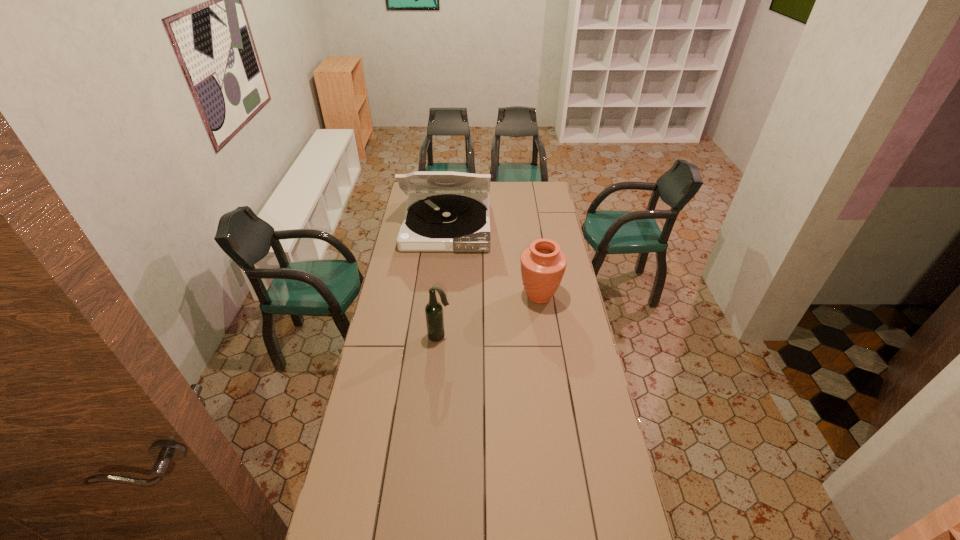
At what (x,y) coordinates should I click in order to perform the action: click on vacant space at the left edge of the desktop. Please return your answer as a coordinate pair (x, y). Looking at the image, I should click on (352, 430).

Where is `vacant space at the right edge`? vacant space at the right edge is located at coordinates (566, 425).

Where is `vacant point located between the nearest object and the vase`? vacant point located between the nearest object and the vase is located at coordinates (490, 316).

Image resolution: width=960 pixels, height=540 pixels. Identify the location of vacant area between the vase and the beer bottle. (490, 316).

Where is `unoccupied area between the rightmost object and the nearest object`? This screenshot has height=540, width=960. unoccupied area between the rightmost object and the nearest object is located at coordinates (490, 316).

The height and width of the screenshot is (540, 960). Find the location of `empty space between the farthest object and the rightmost object`. empty space between the farthest object and the rightmost object is located at coordinates (493, 261).

What are the coordinates of `vacant area that lies between the vase and the tallest object` in the screenshot? It's located at (493, 261).

At what (x,y) coordinates should I click in order to perform the action: click on object that is the closest to the farthest object. Please return your answer as a coordinate pair (x, y). This screenshot has height=540, width=960. Looking at the image, I should click on (543, 265).

Identify the location of object that ranks as the closest to the vase. (446, 211).

Where is `free point that satisfies the following two spatial constraints: 1. on the control panel of the nearest object; 2. on the left side of the tallest object`? free point that satisfies the following two spatial constraints: 1. on the control panel of the nearest object; 2. on the left side of the tallest object is located at coordinates (436, 336).